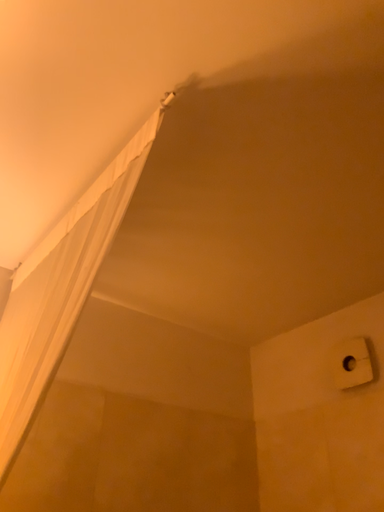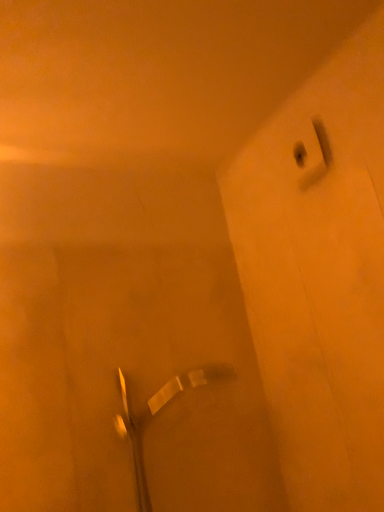
Question: Which way did the camera rotate in the video?

Choices:
 (A) rotated downward
 (B) rotated upward

Answer: (A)